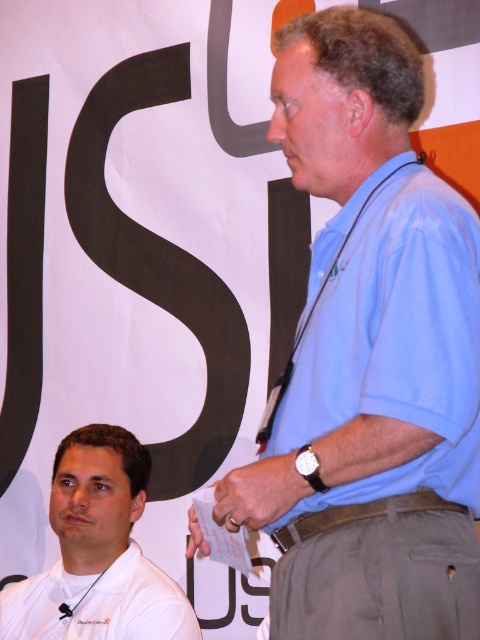
You are an event organizer trying to arrange seating for a panel discussion. You see the light blue shirt at center and the white matte shirt at lower left in the image. Which one is closer to the front of the stage?

The light blue shirt at center is in front of the white matte shirt at lower left, so it is closer to the front of the stage.

You are designing a layout for a magazine cover and need to place two light blue shirts side by side. The light blue shirt at center and the light blue cotton polo shirt at center must be placed on the cover. Given that the magazine cover has limited space, can both shirts be placed next to each other without overlapping?

The light blue shirt at center and the light blue cotton polo shirt at center are 0.94 inches apart from each other, so yes, they can be placed next to each other on the magazine cover without overlapping as there is sufficient space between them.